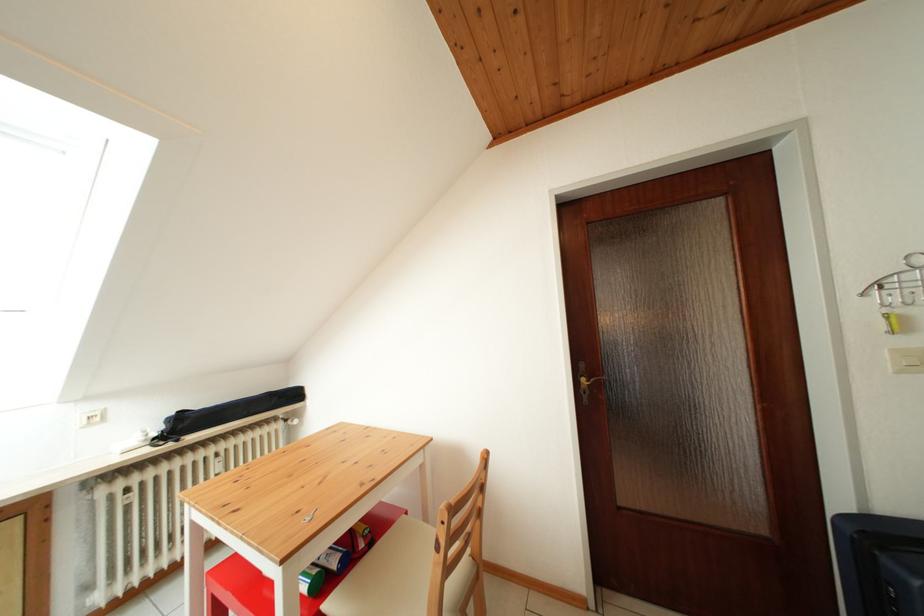
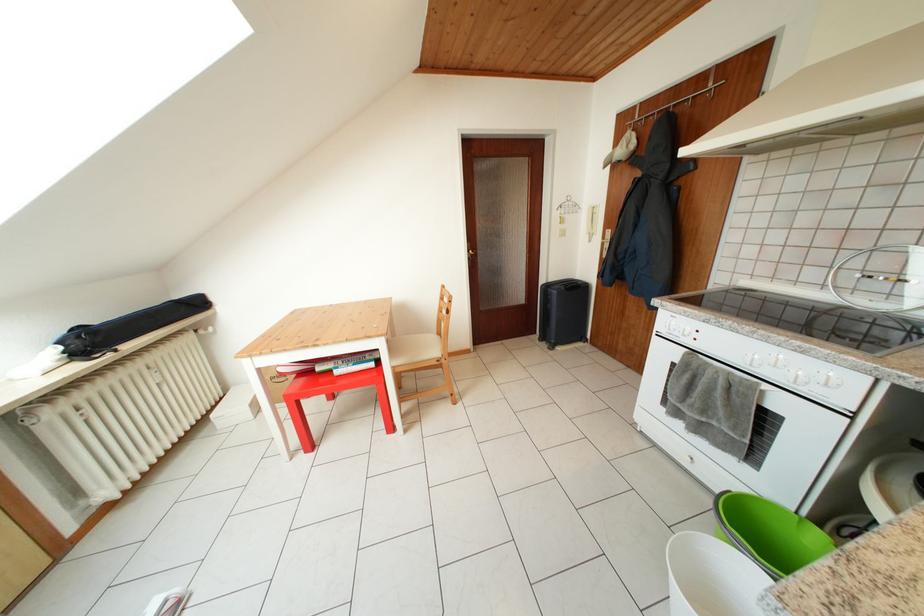
The point at (171,442) is marked in the first image. Where is the corresponding point in the second image?

(89, 359)